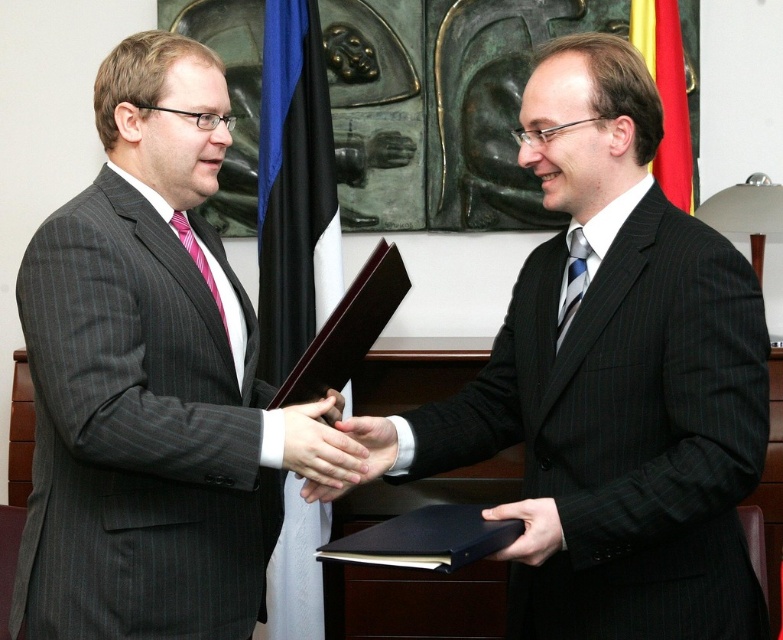
Between smooth skin hand at center and pink striped tie at left, which one has less height?

Standing shorter between the two is smooth skin hand at center.

Between smooth skin hand at center and pink striped tie at left, which one is positioned higher?

Positioned higher is pink striped tie at left.

Describe the element at coordinates (365, 458) in the screenshot. The height and width of the screenshot is (640, 783). I see `smooth skin hand at center` at that location.

Where is `smooth skin hand at center`? The height and width of the screenshot is (640, 783). smooth skin hand at center is located at coordinates (365, 458).

Between smooth skin hand at center and blue striped tie at center, which one is positioned higher?

blue striped tie at center is above.

Measure the distance between smooth skin hand at center and camera.

The distance of smooth skin hand at center from camera is 1.55 meters.

The width and height of the screenshot is (783, 640). What are the coordinates of `smooth skin hand at center` in the screenshot? It's located at (365, 458).

Is point (518, 545) less distant than point (183, 234)?

That is True.

Is black leather folder at lower center taller than pink striped tie at left?

In fact, black leather folder at lower center may be shorter than pink striped tie at left.

Describe the element at coordinates (529, 529) in the screenshot. I see `black leather folder at lower center` at that location.

Locate an element on the screen. This screenshot has width=783, height=640. black leather folder at lower center is located at coordinates (529, 529).